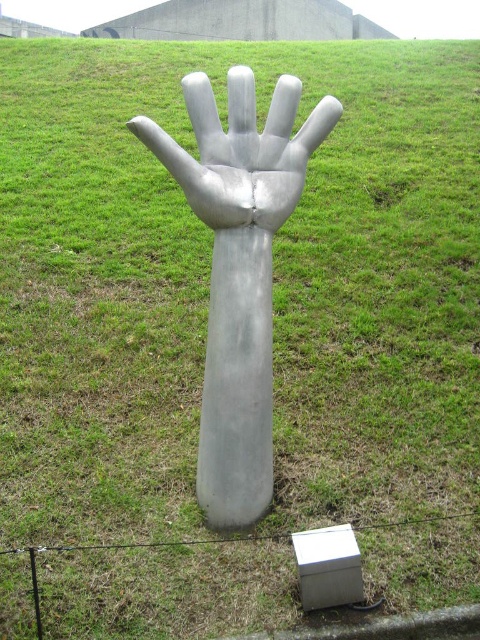
You are a photographer standing on the grassy slope and want to take a photo of both the silver metallic hand at center and the shiny metallic hand at center. Which one will appear closer to you in the photo?

The silver metallic hand at center will appear closer to you in the photo because it is positioned further to the viewer than the shiny metallic hand at center.

You are an artist planning to photograph the silver metallic hand at center and the shiny metallic hand at center. You want to ensure both are fully visible in the frame. Given that your camera has a fixed focal length, which hand should you focus on to capture both without cropping?

The silver metallic hand at center is larger in size than the shiny metallic hand at center, so focusing on the larger silver metallic hand at center will ensure both are fully visible in the frame without cropping.